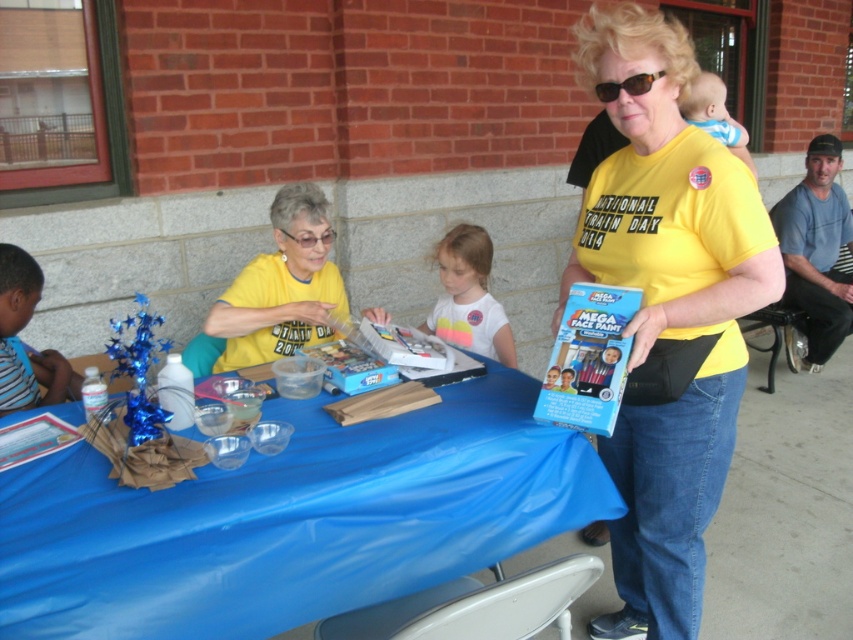
You are a photographer at the event and need to capture a photo where both the yellow fabric shirt at center and the blue denim jeans at lower right are visible. Which object should you focus on first to ensure both are in frame?

The yellow fabric shirt at center is much taller than the blue denim jeans at lower right, so focusing on the yellow fabric shirt at center first will ensure both are in frame.

In the scene shown: You are a visitor at the event and want to know which of the two points, point (459, 316) or point (55, 368), is closer to you. Which one is closer?

Point (459, 316) is closer to you because it is further to the viewer than point (55, 368).